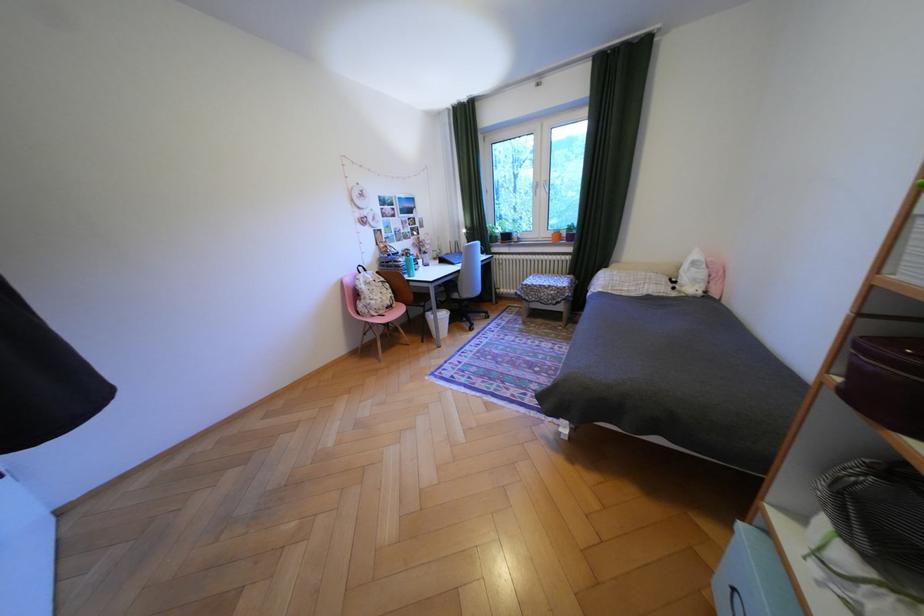
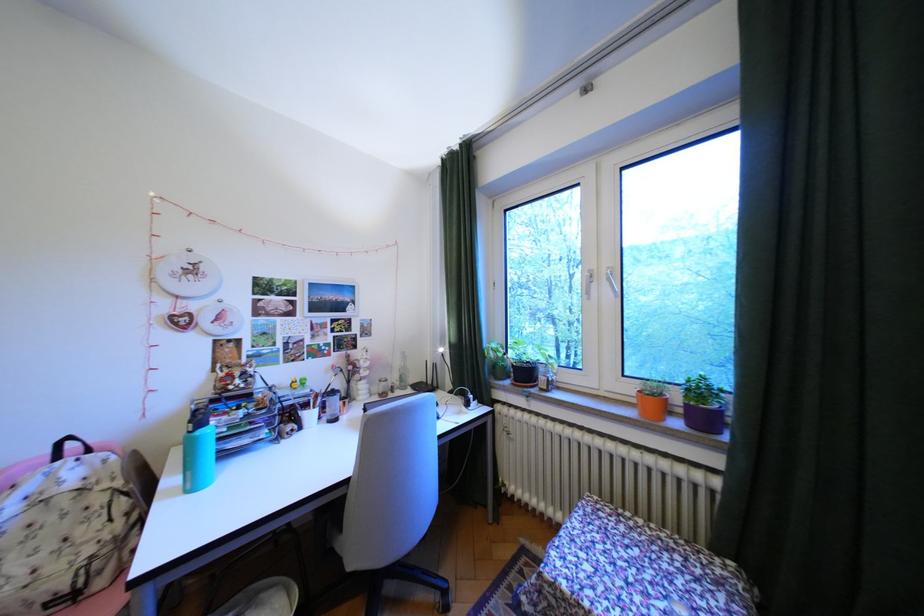
Where in the second image is the point corresponding to pixel 562 233 from the first image?

(641, 390)